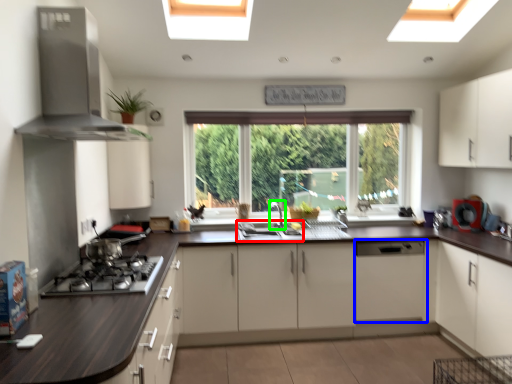
Question: Which is farther away from sink (highlighted by a red box)? cabinetry (highlighted by a blue box) or faucet (highlighted by a green box)?

Choices:
 (A) cabinetry
 (B) faucet

Answer: (A)